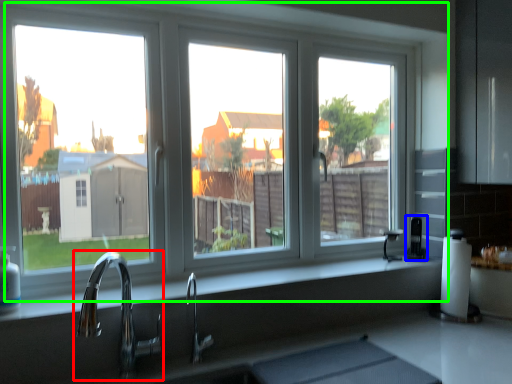
Question: Estimate the real-world distances between objects in this image. Which object is farther from tap (highlighted by a red box), appliance (highlighted by a blue box) or window (highlighted by a green box)?

Choices:
 (A) appliance
 (B) window

Answer: (A)